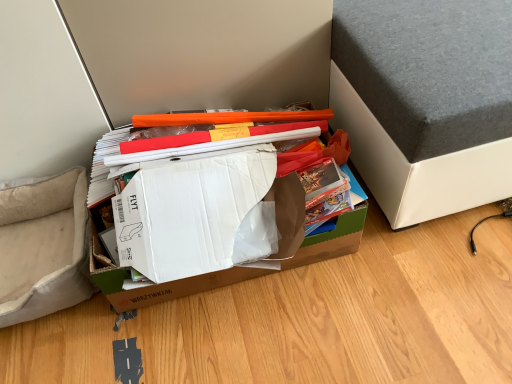
At what (x,y) coordinates should I click in order to perform the action: click on empty space that is in between beige fabric armchair at lower left and brown cardboard box at center. Please return your answer as a coordinate pair (x, y). Looking at the image, I should click on (70, 326).